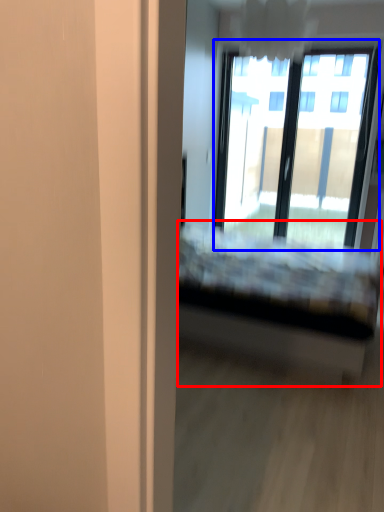
Question: Which point is closer to the camera, bed (highlighted by a red box) or window (highlighted by a blue box)?

Choices:
 (A) bed
 (B) window

Answer: (A)